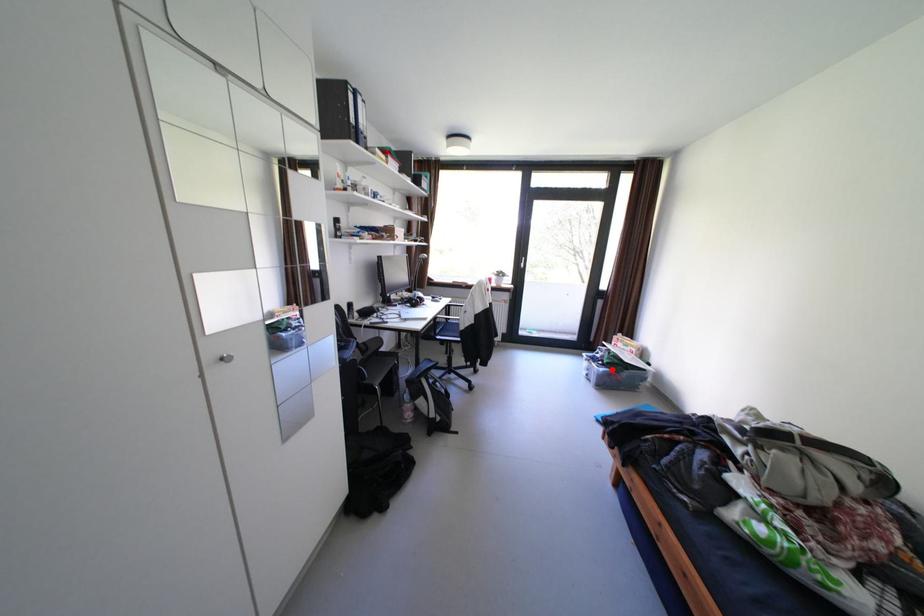
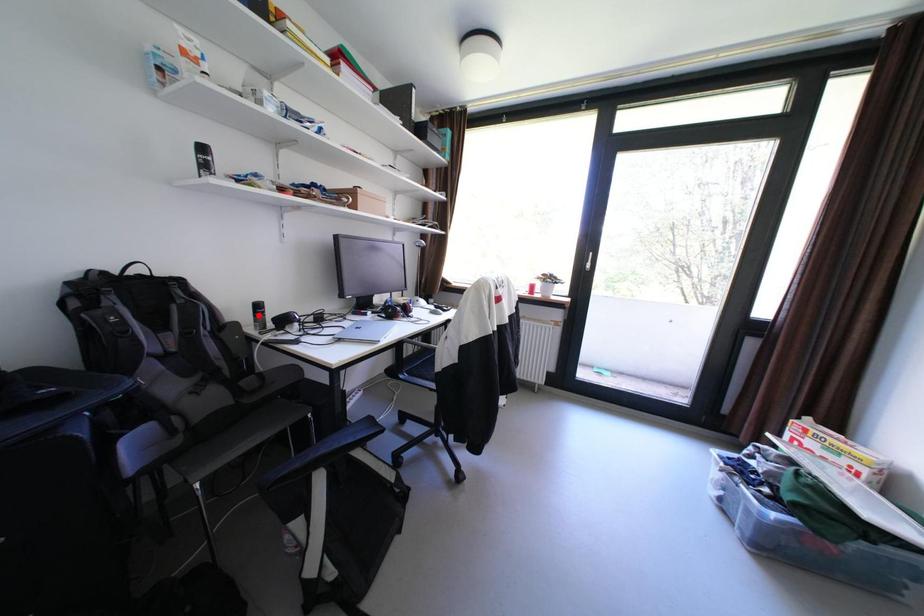
I am providing you with two images of the same scene from different viewpoints. A red point is marked on the first image and another point is marked on the second image. Are the points marked in image1 and image2 representing the same 3D position?

No